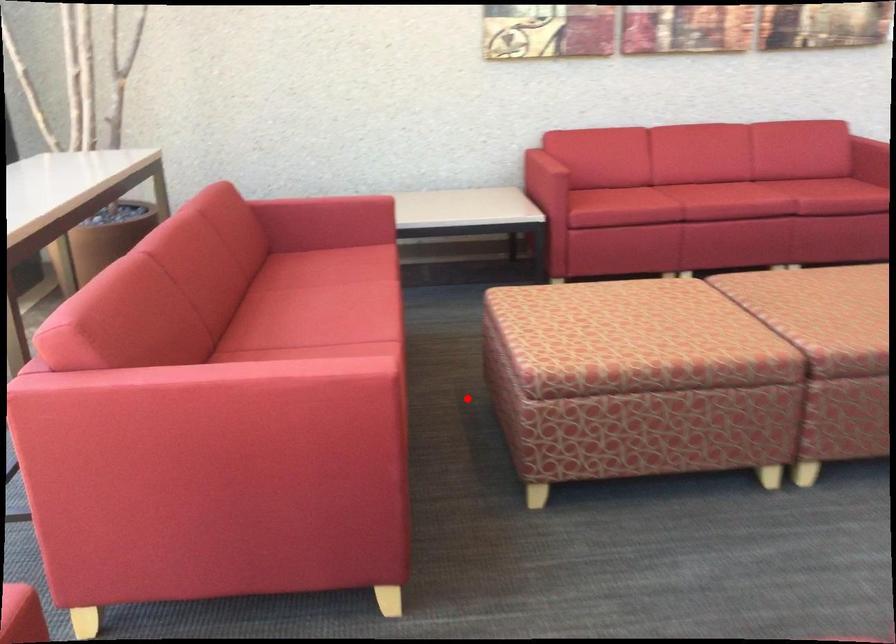
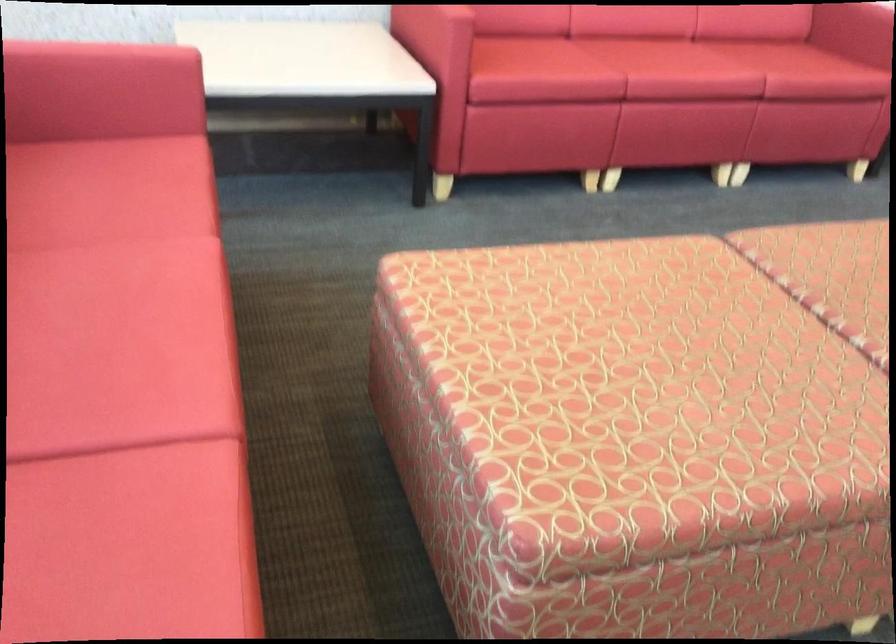
Question: I am providing you with two images of the same scene from different viewpoints. A red point is shown in image1. For the corresponding object point in image2, is it positioned nearer or farther from the camera?

Choices:
 (A) Nearer
 (B) Farther

Answer: (A)